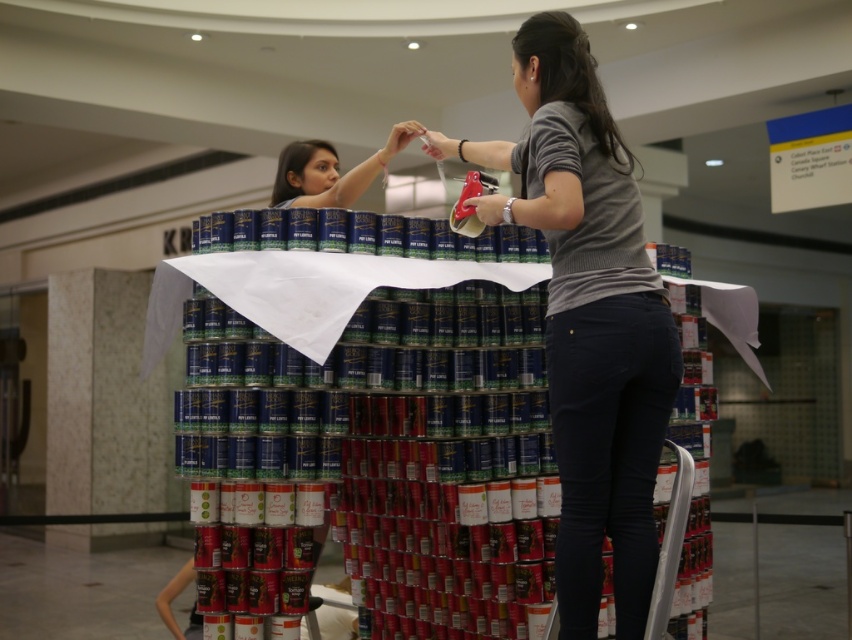
Question: In this image, where is matte black can at center located relative to matte black hair at upper center?

Choices:
 (A) left
 (B) right

Answer: (A)

Question: Which point is closer to the camera taking this photo?

Choices:
 (A) (190, 577)
 (B) (406, 131)

Answer: (B)

Question: Considering the relative positions of matte black can at center and matte black hair at upper center in the image provided, where is matte black can at center located with respect to matte black hair at upper center?

Choices:
 (A) right
 (B) left

Answer: (B)

Question: Which of these objects is positioned closest to the gray knit sweater at center?

Choices:
 (A) matte black can at center
 (B) matte black hair at upper center

Answer: (B)

Question: Estimate the real-world distances between objects in this image. Which object is closer to the gray knit sweater at center?

Choices:
 (A) matte black hair at upper center
 (B) matte black can at center

Answer: (A)

Question: Does matte black can at center have a lesser width compared to matte black hair at upper center?

Choices:
 (A) no
 (B) yes

Answer: (B)